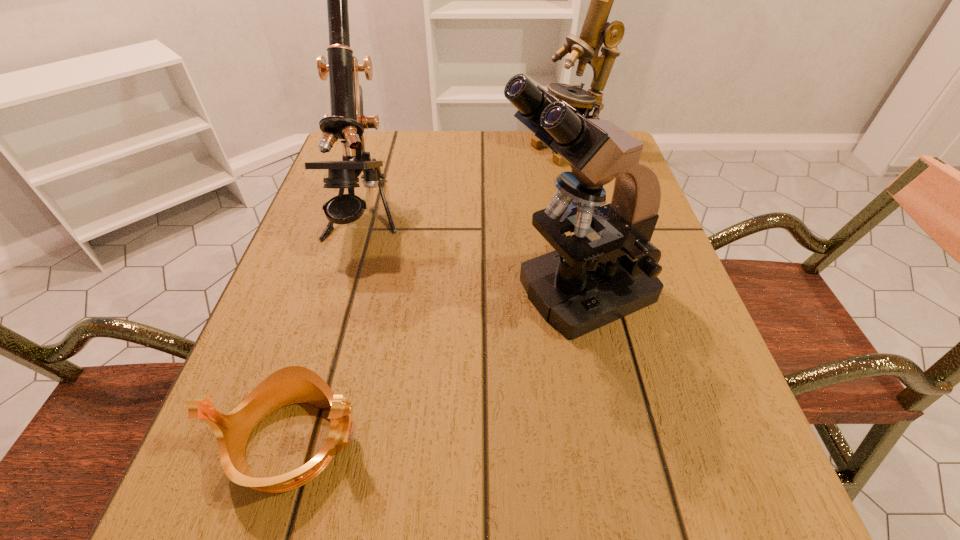
You are a GUI agent. You are given a task and a screenshot of the screen. Output one action in this format:
    pyautogui.click(x=<x>, y=<y>)
    Task: Click on the object that is positioned at the far left corner
    
    Given the screenshot: What is the action you would take?
    pyautogui.click(x=347, y=122)

Identify the location of object that is at the near left corner. Image resolution: width=960 pixels, height=540 pixels. (294, 384).

Identify the location of object that is positioned at the far right corner. (596, 31).

I want to click on vacant space at the far edge of the desktop, so click(x=531, y=136).

In the image, there is a desktop. Find the location of `free space at the left edge`. free space at the left edge is located at coordinates (362, 237).

In the image, there is a desktop. Where is `vacant space at the right edge`? This screenshot has width=960, height=540. vacant space at the right edge is located at coordinates (x=620, y=392).

Identify the location of vacant space at the far left corner of the desktop. The width and height of the screenshot is (960, 540). (382, 145).

This screenshot has width=960, height=540. What are the coordinates of `vacant area that lies between the farthest microscope and the nearest object` in the screenshot? It's located at (431, 295).

Where is `empty space that is in between the farthest microscope and the tiara`? empty space that is in between the farthest microscope and the tiara is located at coordinates (431, 295).

Identify the location of vacant area that lies between the leftmost microscope and the farthest object. (467, 183).